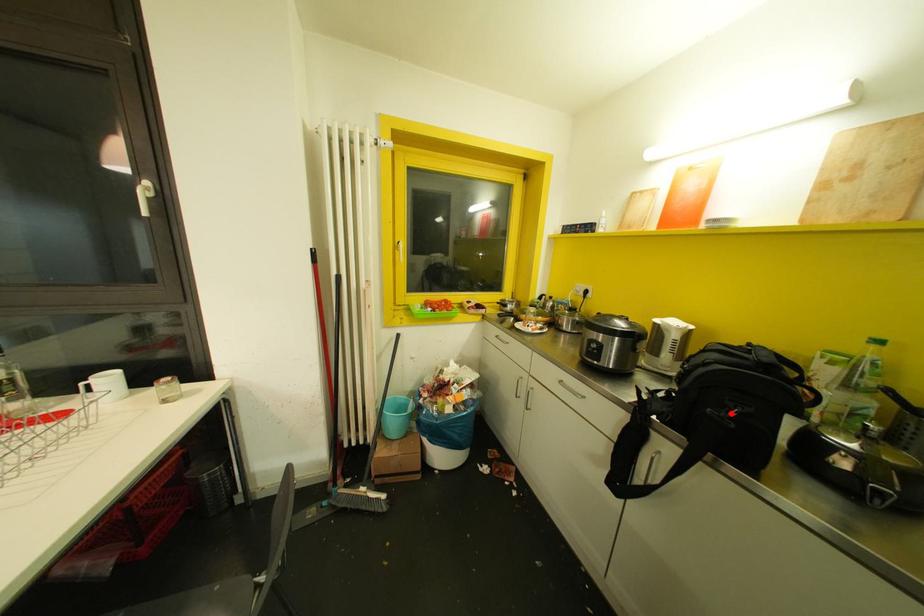
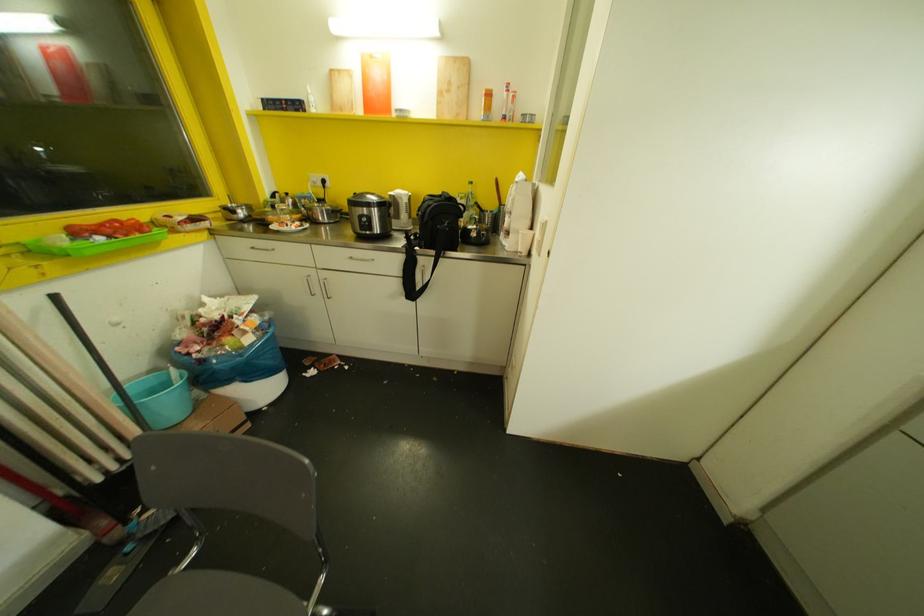
Locate, in the second image, the point that corresponds to the highlighted location in the first image.

(445, 224)